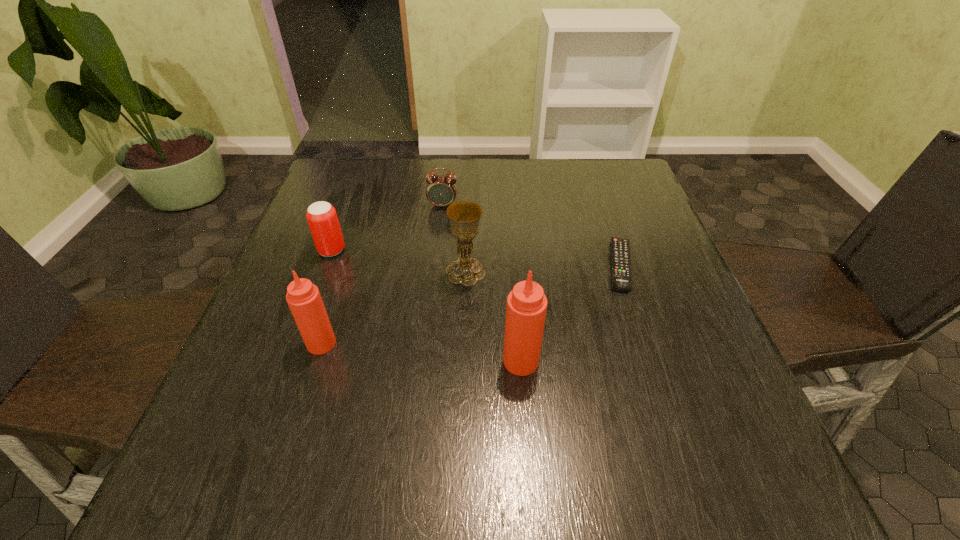
This screenshot has height=540, width=960. I want to click on vacant space located on the face of the farthest object, so click(x=436, y=266).

The width and height of the screenshot is (960, 540). In order to click on vacant space situated on the left of the rightmost object in this screenshot , I will do `click(538, 265)`.

At what (x,y) coordinates should I click in order to perform the action: click on vacant space located 0.140m on the right of the beer can. Please return your answer as a coordinate pair (x, y). This screenshot has width=960, height=540. Looking at the image, I should click on (405, 251).

Find the location of a particular element. free space located on the front of the chalice is located at coordinates point(461,414).

This screenshot has width=960, height=540. I want to click on object positioned at the far edge, so click(441, 190).

I want to click on Tabasco sauce that is at the left edge, so click(304, 299).

Locate an element on the screen. The image size is (960, 540). beer can at the left edge is located at coordinates (322, 218).

Identify the location of object present at the right edge. The height and width of the screenshot is (540, 960). (620, 252).

Find the location of a particular element. This screenshot has width=960, height=540. free region at the far edge of the desktop is located at coordinates (416, 170).

In order to click on free space at the near edge in this screenshot , I will do `click(337, 390)`.